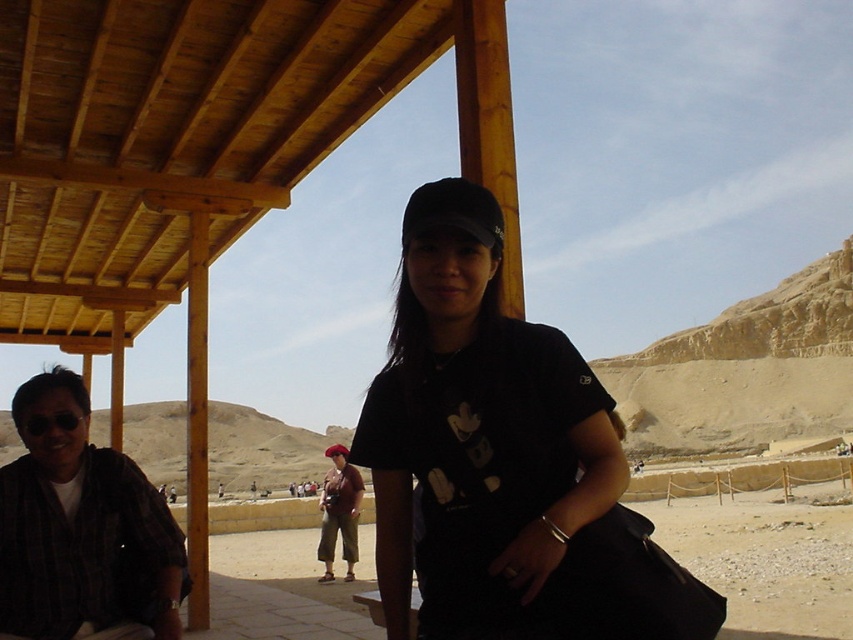
You are a photographer who wants to take a photo of the red fabric beret at center and the matte black camera at center. Since you want to emphasize the size difference between them, which object should you place closer to the camera to make the smaller one appear larger in the photo?

The red fabric beret at center has a smaller size compared to matte black camera at center. To make the smaller object appear larger in the photo, you should place the red fabric beret at center closer to the camera.

You are a photographer setting up a shot of the two people under the pavilion. The plaid shirt at left and the red fabric beret at center are in your frame. You want to ensure the subject with the wider object is centered. Which object should you focus on?

The plaid shirt at left is wider than the red fabric beret at center, so you should focus on the plaid shirt at left to center the wider object.

You are standing in the desert scene and want to locate the plaid shirt at left. According to the coordinates given, where would you look relative to the center of the image?

The plaid shirt at left is located at coordinates 0.817 on the x axis and 0.091 on the y axis, which places it slightly to the right and lower than the center of the image.